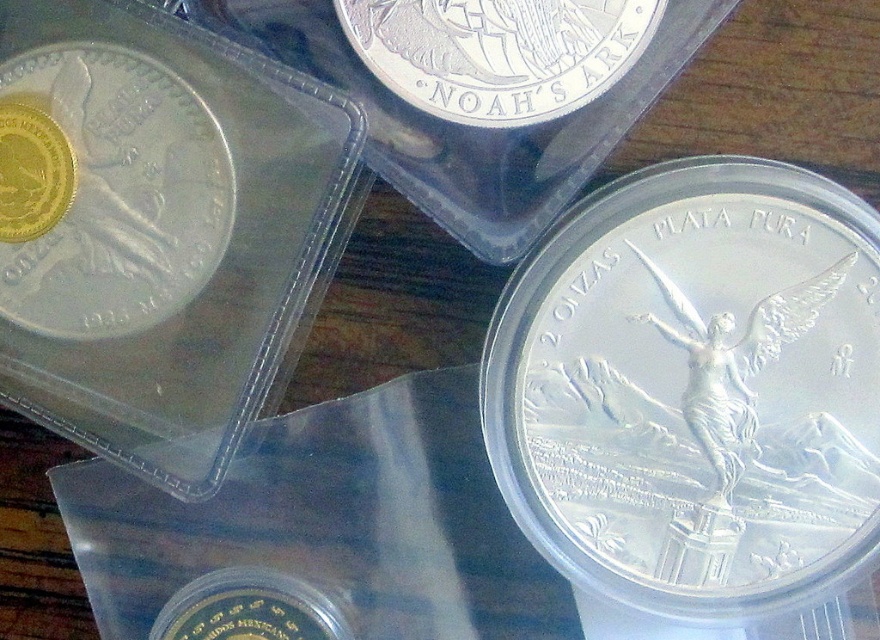
Question: Is gold plated coin at lower left to the left of gold plated coin at upper left from the viewer's perspective?

Choices:
 (A) no
 (B) yes

Answer: (A)

Question: Which point is closer to the camera?

Choices:
 (A) (627, 17)
 (B) (72, 301)
 (C) (848, 465)
 (D) (180, 625)

Answer: (A)

Question: Can you confirm if satin silver coin at center is bigger than gold plated coin at lower left?

Choices:
 (A) yes
 (B) no

Answer: (A)

Question: Which object appears farthest from the camera in this image?

Choices:
 (A) satin silver coin at center
 (B) matte silver coin at left
 (C) gold plated coin at lower left
 (D) silver/highly polished coin at upper center

Answer: (C)

Question: Which of these objects is positioned farthest from the gold plated coin at upper left?

Choices:
 (A) matte silver coin at left
 (B) satin silver coin at center

Answer: (B)

Question: Where is matte silver coin at left located in relation to gold plated coin at upper left in the image?

Choices:
 (A) above
 (B) below

Answer: (B)